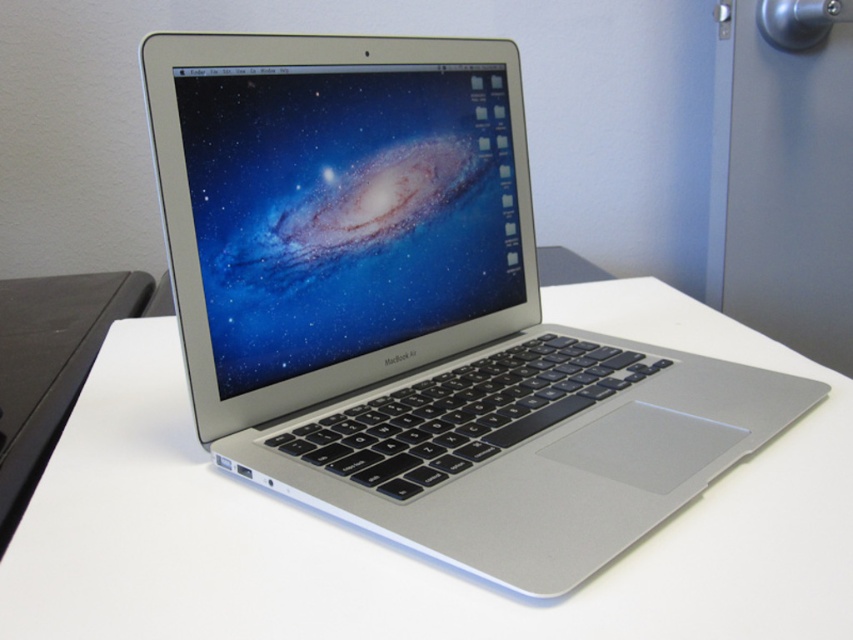
You are setting up a workspace and need to place the silver metallic laptop at center on the white matte table at center. Based on the scene description, can you confirm if the laptop is already placed on the table?

The silver metallic laptop at center is above white matte table at center, so yes, it is placed on the table.

You are setting up a desk and need to ensure that the silver metallic laptop at center can fit on the white matte table at center. Based on their heights, can the laptop be placed on the table without any issues?

The silver metallic laptop at center is taller than the white matte table at center, so placing it on the table would not be possible as the laptop is taller than the table itself.

You are a photographer setting up a shot of the silver metallic laptop at center and the white matte table at center. Which object is closer to the camera lens?

The silver metallic laptop at center is closer to the camera lens than the white matte table at center because it is further to the viewer.